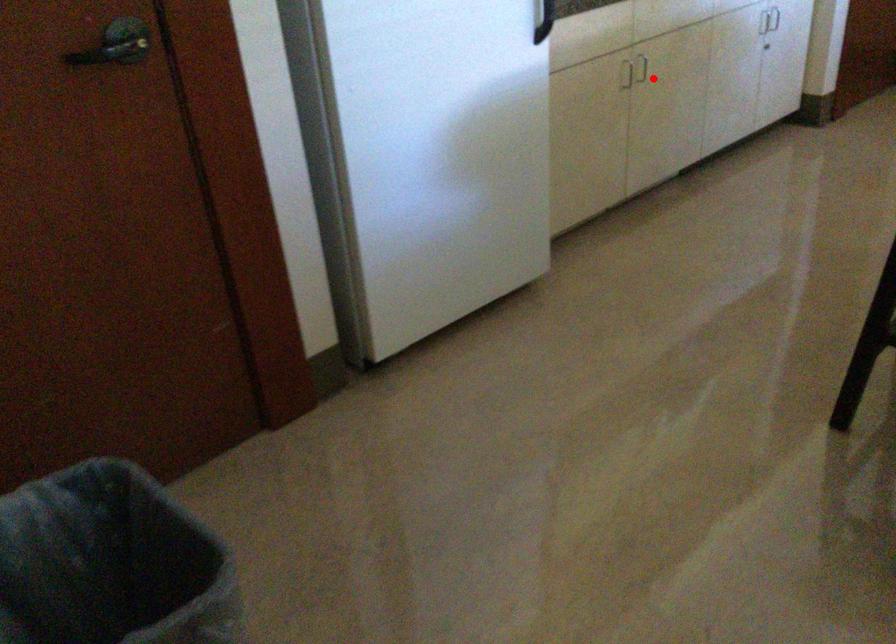
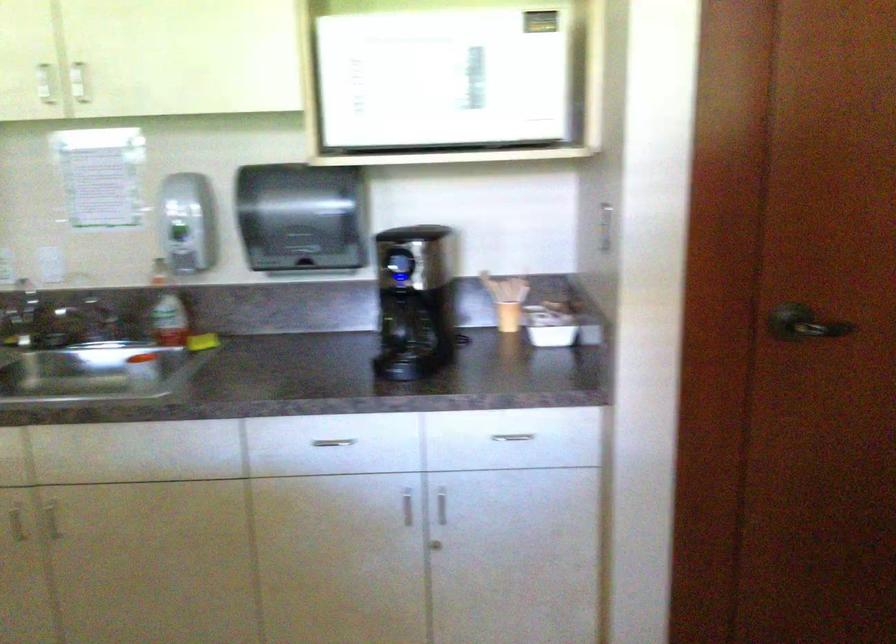
Question: I am providing you with two images of the same scene from different viewpoints. Given a red point in image1, look at the same physical point in image2. Is it:

Choices:
 (A) Closer to the viewpoint
 (B) Farther from the viewpoint

Answer: (A)